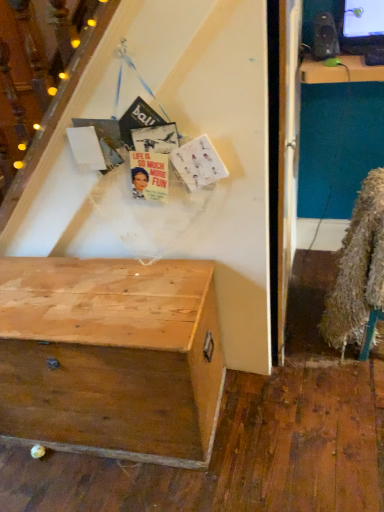
Question: Choose the correct answer: Is fuzzy brown fur coat at lower right inside wooden chest at lower left or outside it?

Choices:
 (A) outside
 (B) inside

Answer: (A)

Question: Looking at the image, does fuzzy brown fur coat at lower right seem bigger or smaller compared to wooden chest at lower left?

Choices:
 (A) big
 (B) small

Answer: (B)

Question: Which of these objects is positioned farthest from the matte black speaker at upper right?

Choices:
 (A) fuzzy brown fur coat at lower right
 (B) wooden chest at lower left

Answer: (B)

Question: Which is nearer to the wooden chest at lower left?

Choices:
 (A) matte black speaker at upper right
 (B) fuzzy brown fur coat at lower right

Answer: (B)